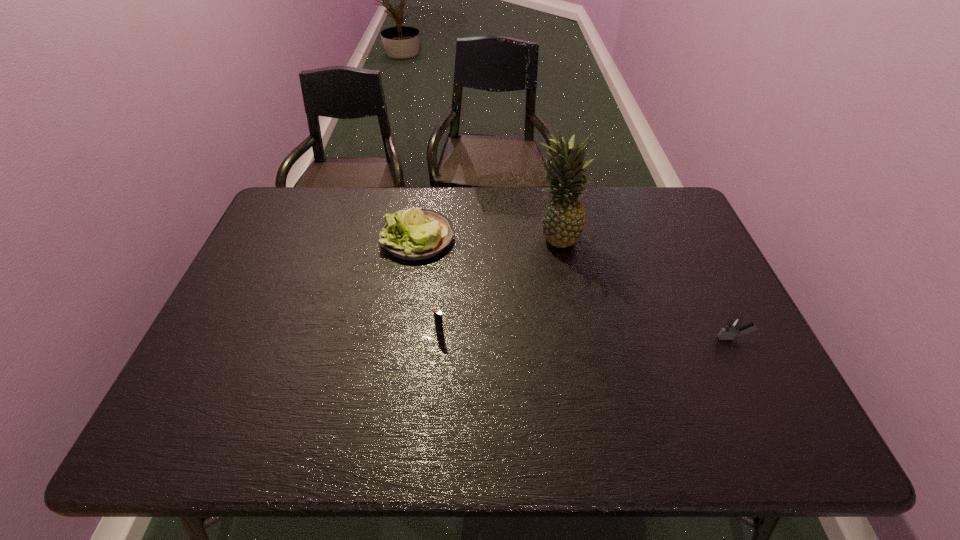
Locate an element on the screen. free space in the image that satisfies the following two spatial constraints: 1. on the front side of the right igniter; 2. on the left side of the tallest object is located at coordinates (574, 338).

This screenshot has height=540, width=960. Find the location of `free space that satisfies the following two spatial constraints: 1. on the front side of the third object from left to right; 2. on the right side of the right igniter`. free space that satisfies the following two spatial constraints: 1. on the front side of the third object from left to right; 2. on the right side of the right igniter is located at coordinates (574, 338).